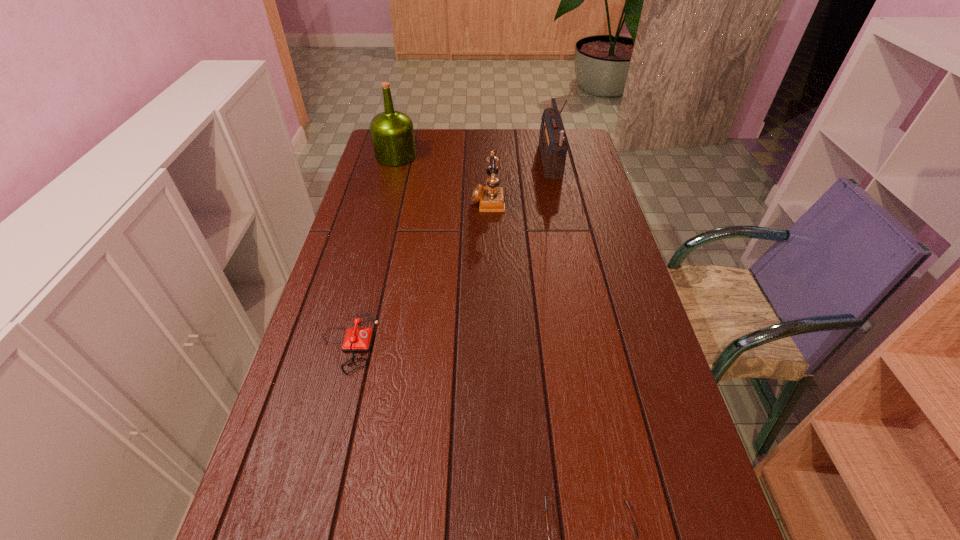
At what (x,y) coordinates should I click in order to perform the action: click on vacant region located on the dial number of the third tallest object. Please return your answer as a coordinate pair (x, y). This screenshot has height=540, width=960. Looking at the image, I should click on (396, 199).

The width and height of the screenshot is (960, 540). Identify the location of vacant region located 0.130m on the dial number of the third tallest object. (434, 199).

Find the location of `vacant space located on the dial number of the third tallest object`. vacant space located on the dial number of the third tallest object is located at coordinates (457, 199).

Where is `free location located on the dial of the shorter telephone`? free location located on the dial of the shorter telephone is located at coordinates (407, 342).

At what (x,y) coordinates should I click in order to perform the action: click on radio receiver located at the far edge. Please return your answer as a coordinate pair (x, y). Looking at the image, I should click on (553, 143).

This screenshot has height=540, width=960. What are the coordinates of `olive oil that is at the far edge` in the screenshot? It's located at (392, 132).

You are a GUI agent. You are given a task and a screenshot of the screen. Output one action in this format:
    pyautogui.click(x=<x>, y=<y>)
    Task: Click on the olive oil that is positioned at the left edge
    The width and height of the screenshot is (960, 540).
    Given the screenshot: What is the action you would take?
    pyautogui.click(x=392, y=132)

Locate an element on the screen. The width and height of the screenshot is (960, 540). telephone situated at the left edge is located at coordinates (356, 339).

Image resolution: width=960 pixels, height=540 pixels. I want to click on object that is at the right edge, so click(553, 143).

Where is `object that is at the far left corner`? object that is at the far left corner is located at coordinates (392, 132).